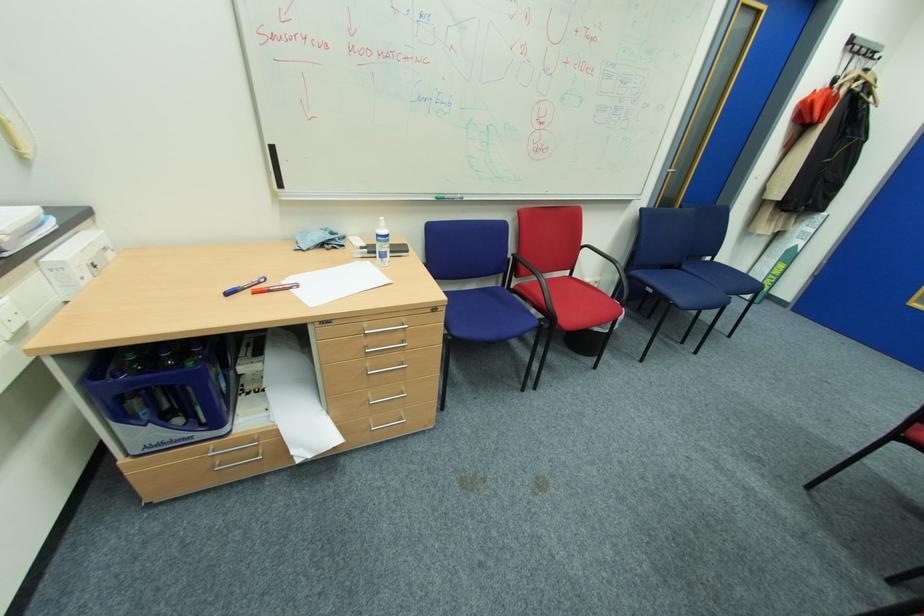
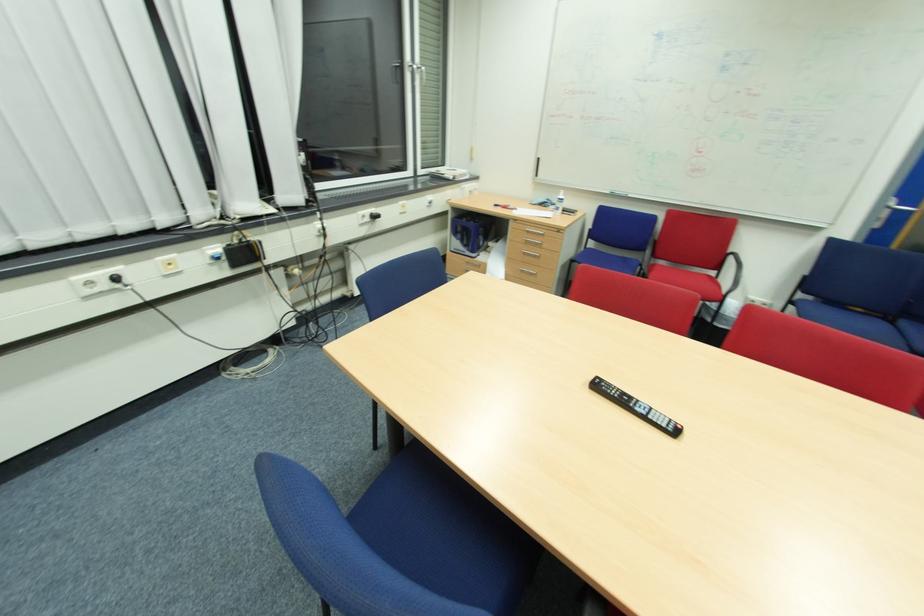
Locate, in the second image, the point that corresponds to (x=164, y=445) in the first image.

(462, 249)